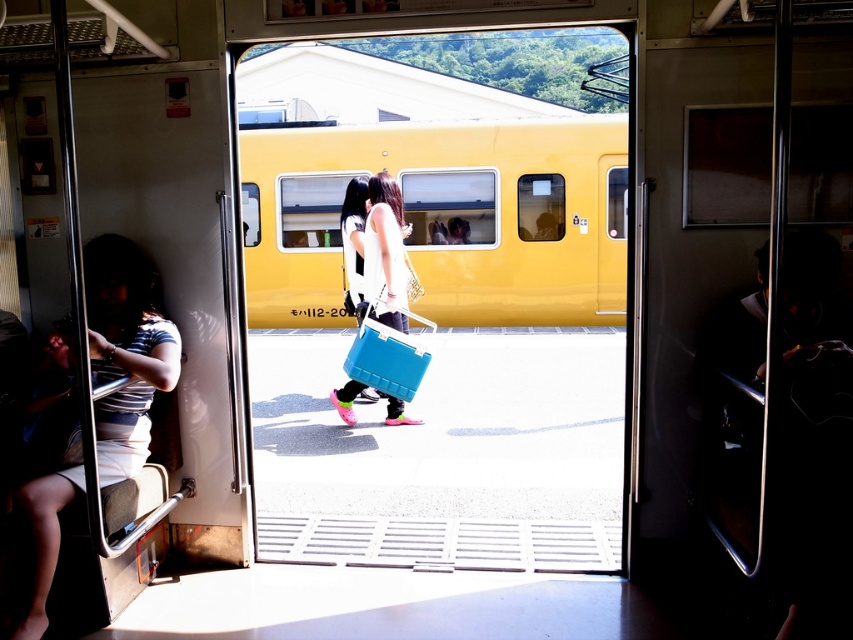
From the picture: You are standing on the platform waiting for the train to pass. You notice the yellow matte train at center and the striped fabric shirt at left. How far apart are these two objects?

The yellow matte train at center and the striped fabric shirt at left are 7.29 meters apart.

You are a fashion designer observing two shirts in a train scene. The striped fabric shirt at left and the matte white shirt at center. Which shirt has a larger size?

The matte white shirt at center is larger than the striped fabric shirt at left.